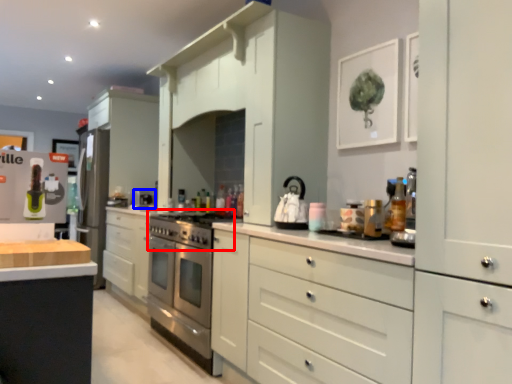
Question: Among these objects, which one is nearest to the camera, gas stove (highlighted by a red box) or appliance (highlighted by a blue box)?

Choices:
 (A) gas stove
 (B) appliance

Answer: (A)